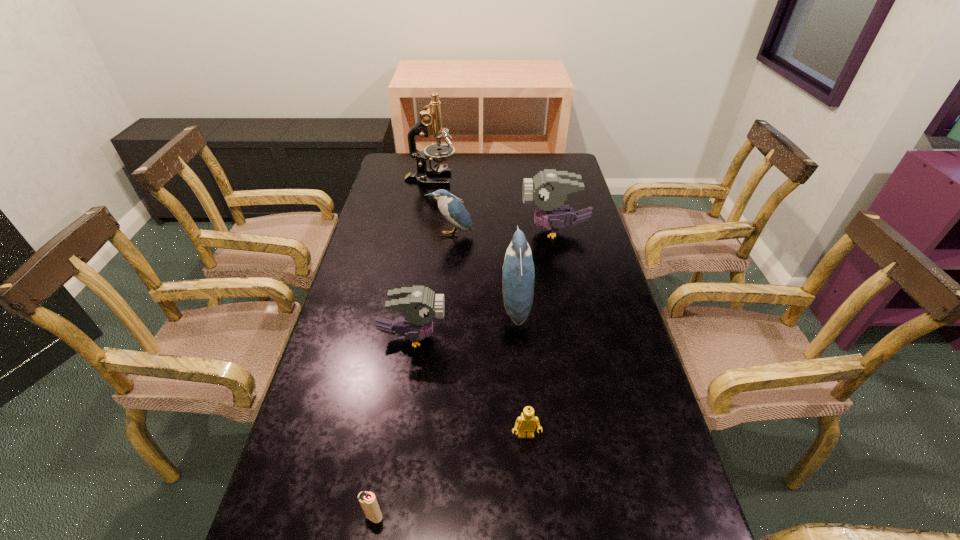
Identify the location of Lego. The height and width of the screenshot is (540, 960). (526, 422).

Find the location of a particular element. Image resolution: width=960 pixels, height=540 pixels. igniter is located at coordinates pyautogui.click(x=367, y=500).

Locate an element on the screen. the nearest object is located at coordinates (367, 500).

Find the location of a particular element. The image size is (960, 540). vacant area located 0.130m at the eyepiece of the farthest object is located at coordinates click(488, 179).

Where is `vacant space situated 0.190m at the tip of the nearer blue bird's beak`? vacant space situated 0.190m at the tip of the nearer blue bird's beak is located at coordinates (436, 306).

Where is `free space located 0.310m at the tip of the nearer blue bird's beak`? This screenshot has width=960, height=540. free space located 0.310m at the tip of the nearer blue bird's beak is located at coordinates (395, 306).

At what (x,y) coordinates should I click in order to perform the action: click on blank space located 0.310m at the tip of the nearer blue bird's beak. Please return your answer as a coordinate pair (x, y). The width and height of the screenshot is (960, 540). Looking at the image, I should click on (395, 306).

This screenshot has height=540, width=960. I want to click on vacant area situated 0.250m at the beak of the farther gray bird, so coord(450,231).

At what (x,y) coordinates should I click in order to perform the action: click on free space located 0.310m at the beak of the farther gray bird. Please return your answer as a coordinate pair (x, y). The width and height of the screenshot is (960, 540). Looking at the image, I should click on (433, 231).

I want to click on vacant area situated at the beak of the farther gray bird, so click(x=475, y=231).